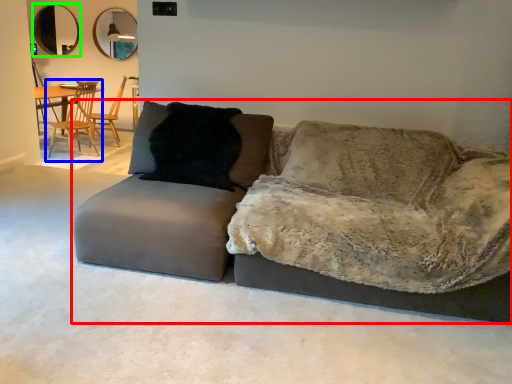
Question: Which is farther away from studio couch (highlighted by a red box)? chair (highlighted by a blue box) or mirror (highlighted by a green box)?

Choices:
 (A) chair
 (B) mirror

Answer: (B)